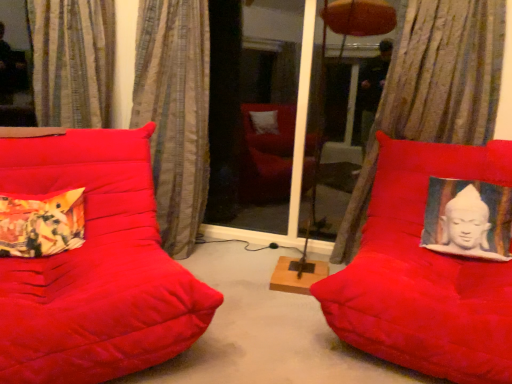
Find the location of a particular element. This screenshot has height=384, width=512. free spot to the right of textured beige curtain at left, which is counted as the second curtain, starting from the right is located at coordinates (227, 254).